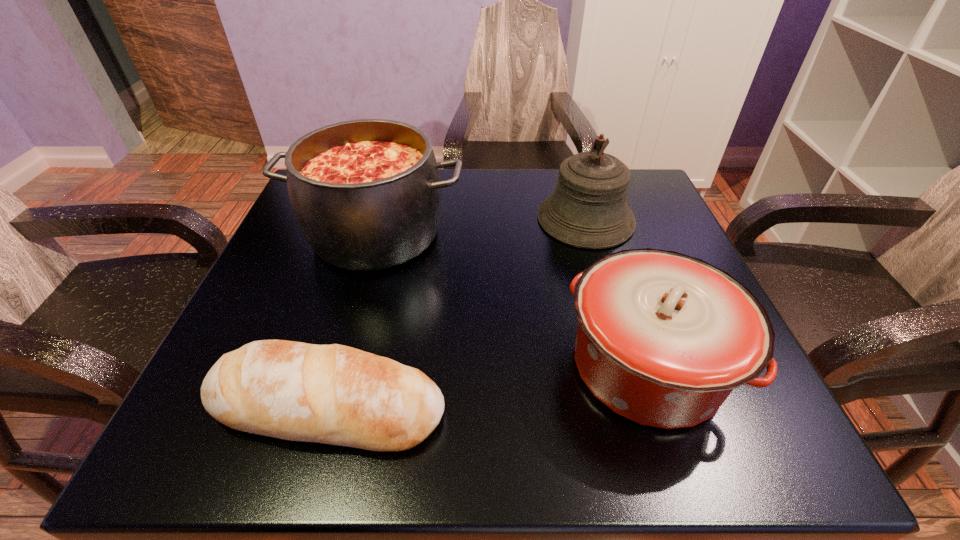
Where is `bell positioned at the far edge`? This screenshot has width=960, height=540. bell positioned at the far edge is located at coordinates (588, 209).

Locate an element on the screen. The width and height of the screenshot is (960, 540). casserole located at the far edge is located at coordinates (366, 193).

You are a GUI agent. You are given a task and a screenshot of the screen. Output one action in this format:
    pyautogui.click(x=<x>, y=<y>)
    Task: Click on the casserole at the near edge
    This screenshot has width=960, height=540.
    Given the screenshot: What is the action you would take?
    pyautogui.click(x=663, y=338)

Where is `bread located in the near edge section of the desktop`? The width and height of the screenshot is (960, 540). bread located in the near edge section of the desktop is located at coordinates [333, 394].

At what (x,y) coordinates should I click in order to perform the action: click on casserole that is positioned at the left edge. Please return your answer as a coordinate pair (x, y). The height and width of the screenshot is (540, 960). Looking at the image, I should click on (366, 193).

Locate an element on the screen. The width and height of the screenshot is (960, 540). bread that is at the left edge is located at coordinates (333, 394).

This screenshot has width=960, height=540. Identify the location of bell present at the right edge. (588, 209).

Locate an element on the screen. The height and width of the screenshot is (540, 960). casserole at the right edge is located at coordinates (663, 338).

Locate an element on the screen. The height and width of the screenshot is (540, 960). object present at the far left corner is located at coordinates (366, 193).

Where is `object situated at the near left corner`? The image size is (960, 540). object situated at the near left corner is located at coordinates (333, 394).